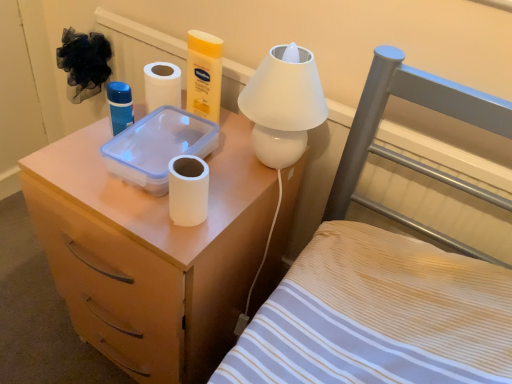
This screenshot has height=384, width=512. Identify the location of free space that is in between white glossy table lamp at upper center and white matte toilet paper at center. (230, 198).